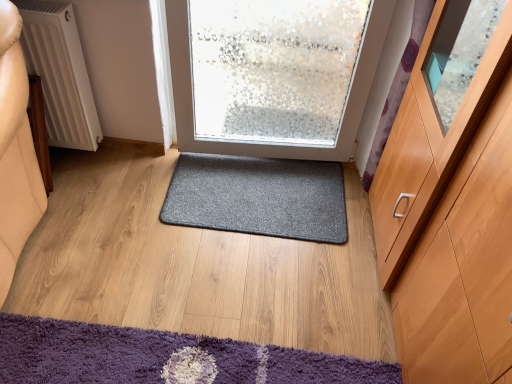
In order to face white textured radiator at left, should I rotate leftwards or rightwards?

To face it directly, rotate left by 24.419 degrees.

The image size is (512, 384). What do you see at coordinates (451, 202) in the screenshot? I see `light brown wood cabinet at right` at bounding box center [451, 202].

Where is `purple shaggy mat at lower left, the second mat positioned from the top`? purple shaggy mat at lower left, the second mat positioned from the top is located at coordinates (163, 358).

The image size is (512, 384). Identify the location of white textured radiator at left. (60, 73).

The width and height of the screenshot is (512, 384). I want to click on cabinetry above the purple shaggy mat at lower left, the second mat viewed from the back (from the image's perspective), so click(x=451, y=202).

Are light brown wood cabinet at right and purple shaggy mat at lower left, the second mat positioned from the top, beside each other?

There is a gap between light brown wood cabinet at right and purple shaggy mat at lower left, the second mat positioned from the top.

From a real-world perspective, is light brown wood cabinet at right located higher than purple shaggy mat at lower left, the 1th mat positioned from the front?

Indeed, from a real-world perspective, light brown wood cabinet at right stands above purple shaggy mat at lower left, the 1th mat positioned from the front.

Is light brown wood cabinet at right oriented towards purple shaggy mat at lower left, the 1th mat positioned from the front?

Yes, light brown wood cabinet at right is oriented towards purple shaggy mat at lower left, the 1th mat positioned from the front.

Which of these two, purple shaggy mat at lower left, the 1th mat positioned from the front, or light brown wood cabinet at right, is bigger?

Bigger between the two is light brown wood cabinet at right.

Does point (8, 318) come behind point (454, 368)?

Yes, point (8, 318) is farther from viewer.

Is purple shaggy mat at lower left, which is the 1th mat in bottom-to-top order, oriented away from light brown wood cabinet at right?

Yes, purple shaggy mat at lower left, which is the 1th mat in bottom-to-top order,'s orientation is away from light brown wood cabinet at right.

From a real-world perspective, is purple shaggy mat at lower left, which is the 1th mat in bottom-to-top order, on top of light brown wood cabinet at right?

No, from a real-world perspective, purple shaggy mat at lower left, which is the 1th mat in bottom-to-top order, is not on top of light brown wood cabinet at right.

Considering the relative positions of dark gray carpet at center, the second mat when ordered from bottom to top, and purple shaggy mat at lower left, the second mat positioned from the top, in the image provided, is dark gray carpet at center, the second mat when ordered from bottom to top, to the left of purple shaggy mat at lower left, the second mat positioned from the top, from the viewer's perspective?

No.

Between dark gray carpet at center, the second mat when ordered from bottom to top, and purple shaggy mat at lower left, the second mat viewed from the back, which one is positioned in front?

purple shaggy mat at lower left, the second mat viewed from the back, is in front.

Does dark gray carpet at center, placed as the first mat when sorted from top to bottom, have a greater height compared to purple shaggy mat at lower left, the second mat viewed from the back?

Incorrect, the height of dark gray carpet at center, placed as the first mat when sorted from top to bottom, is not larger of that of purple shaggy mat at lower left, the second mat viewed from the back.

Is dark gray carpet at center, which appears as the 2th mat when viewed from the front, not close to purple shaggy mat at lower left, which is the 1th mat in bottom-to-top order?

No.

Is dark gray carpet at center, which appears as the 2th mat when viewed from the front, thinner than light brown wood cabinet at right?

Indeed, dark gray carpet at center, which appears as the 2th mat when viewed from the front, has a lesser width compared to light brown wood cabinet at right.

Is point (192, 185) positioned after point (446, 374)?

Yes, it is behind point (446, 374).

Is dark gray carpet at center, the second mat when ordered from bottom to top, surrounding light brown wood cabinet at right?

No, light brown wood cabinet at right is not surrounded by dark gray carpet at center, the second mat when ordered from bottom to top.

From the image's perspective, does dark gray carpet at center, which appears as the 2th mat when viewed from the front, appear higher than light brown wood cabinet at right?

Indeed, from the image's perspective, dark gray carpet at center, which appears as the 2th mat when viewed from the front, is shown above light brown wood cabinet at right.

Does white textured radiator at left appear on the right side of light brown wood cabinet at right?

No.

Who is bigger, white textured radiator at left or light brown wood cabinet at right?

light brown wood cabinet at right is bigger.

This screenshot has width=512, height=384. In order to click on cabinetry on the right of white textured radiator at left in this screenshot , I will do `click(451, 202)`.

Do you think white textured radiator at left is within light brown wood cabinet at right, or outside of it?

white textured radiator at left is spatially situated outside light brown wood cabinet at right.

From the image's perspective, is purple shaggy mat at lower left, the second mat positioned from the top, beneath white textured radiator at left?

Correct, purple shaggy mat at lower left, the second mat positioned from the top, appears lower than white textured radiator at left in the image.

From a real-world perspective, is purple shaggy mat at lower left, which is the 1th mat in bottom-to-top order, positioned under white textured radiator at left based on gravity?

Yes.

Which object is further away from the camera, purple shaggy mat at lower left, the second mat viewed from the back, or white textured radiator at left?

white textured radiator at left is more distant.

Between dark gray carpet at center, positioned as the 1th mat in back-to-front order, and white textured radiator at left, which one has larger width?

dark gray carpet at center, positioned as the 1th mat in back-to-front order, is wider.

Considering the relative positions of dark gray carpet at center, the second mat when ordered from bottom to top, and white textured radiator at left in the image provided, is dark gray carpet at center, the second mat when ordered from bottom to top, behind white textured radiator at left?

Yes.

Is dark gray carpet at center, positioned as the 1th mat in back-to-front order, located outside white textured radiator at left?

dark gray carpet at center, positioned as the 1th mat in back-to-front order, is positioned outside white textured radiator at left.

I want to click on cabinetry on the right of purple shaggy mat at lower left, which is the 1th mat in bottom-to-top order, so click(451, 202).

At what (x,y) coordinates should I click in order to perform the action: click on cabinetry above the purple shaggy mat at lower left, the second mat viewed from the back (from a real-world perspective). Please return your answer as a coordinate pair (x, y). This screenshot has height=384, width=512. Looking at the image, I should click on click(x=451, y=202).

From the image, which object appears to be nearer to dark gray carpet at center, placed as the first mat when sorted from top to bottom, light brown wood cabinet at right or white textured radiator at left?

light brown wood cabinet at right.

Based on their spatial positions, is purple shaggy mat at lower left, the 1th mat positioned from the front, or white textured radiator at left closer to dark gray carpet at center, positioned as the 1th mat in back-to-front order?

Based on the image, purple shaggy mat at lower left, the 1th mat positioned from the front, appears to be nearer to dark gray carpet at center, positioned as the 1th mat in back-to-front order.

From the picture: Based on their spatial positions, is dark gray carpet at center, which appears as the 2th mat when viewed from the front, or light brown wood cabinet at right further from purple shaggy mat at lower left, the second mat positioned from the top?

The object further to purple shaggy mat at lower left, the second mat positioned from the top, is dark gray carpet at center, which appears as the 2th mat when viewed from the front.

Looking at the image, which one is located further to light brown wood cabinet at right, white textured radiator at left or dark gray carpet at center, placed as the first mat when sorted from top to bottom?

white textured radiator at left is positioned further to the anchor light brown wood cabinet at right.

Looking at the image, which one is located further to white textured radiator at left, light brown wood cabinet at right or purple shaggy mat at lower left, the 1th mat positioned from the front?

light brown wood cabinet at right is further to white textured radiator at left.

Which object lies nearer to the anchor point purple shaggy mat at lower left, the 1th mat positioned from the front, dark gray carpet at center, placed as the first mat when sorted from top to bottom, or white textured radiator at left?

The object closer to purple shaggy mat at lower left, the 1th mat positioned from the front, is dark gray carpet at center, placed as the first mat when sorted from top to bottom.

Based on their spatial positions, is light brown wood cabinet at right or dark gray carpet at center, the second mat when ordered from bottom to top, further from purple shaggy mat at lower left, the 1th mat positioned from the front?

Among the two, dark gray carpet at center, the second mat when ordered from bottom to top, is located further to purple shaggy mat at lower left, the 1th mat positioned from the front.

Estimate the real-world distances between objects in this image. Which object is closer to dark gray carpet at center, placed as the first mat when sorted from top to bottom, white textured radiator at left or purple shaggy mat at lower left, the second mat viewed from the back?

purple shaggy mat at lower left, the second mat viewed from the back, lies closer to dark gray carpet at center, placed as the first mat when sorted from top to bottom, than the other object.

The height and width of the screenshot is (384, 512). Identify the location of mat positioned between light brown wood cabinet at right and dark gray carpet at center, placed as the first mat when sorted from top to bottom, from near to far. (163, 358).

At what (x,y) coordinates should I click in order to perform the action: click on mat that lies between white textured radiator at left and purple shaggy mat at lower left, the second mat viewed from the back, from top to bottom. Please return your answer as a coordinate pair (x, y). This screenshot has width=512, height=384. Looking at the image, I should click on (258, 197).